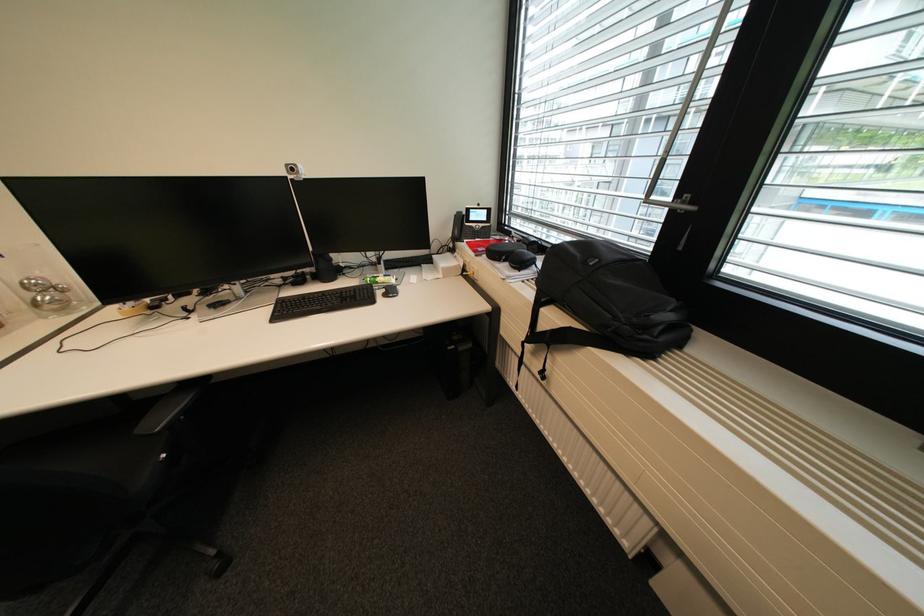
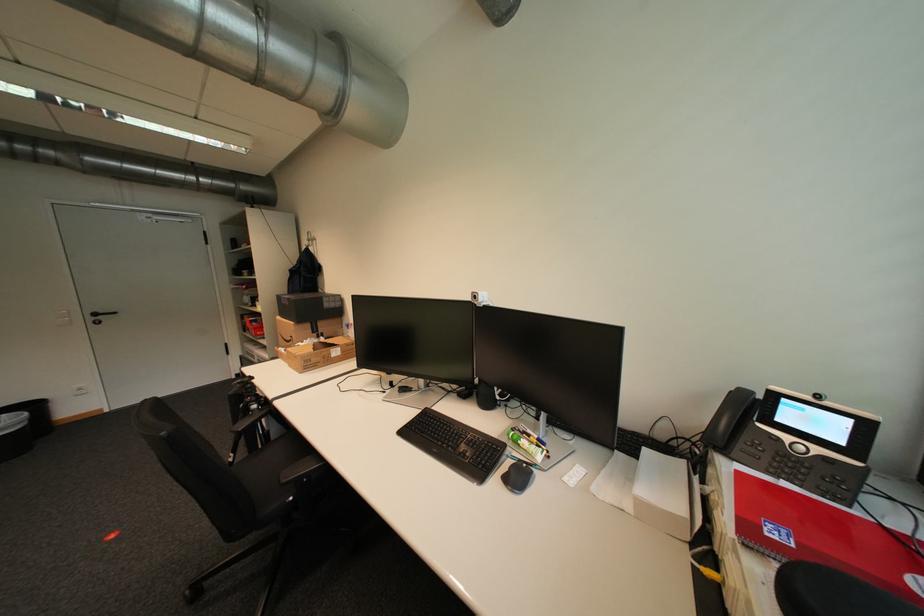
Locate, in the second image, the point that corresponds to point 387,293 in the first image.

(514, 467)